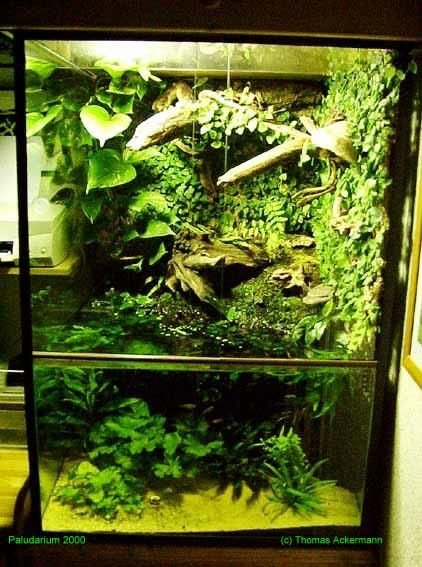
Where is `glass`? This screenshot has height=567, width=422. glass is located at coordinates (217, 308), (184, 456).